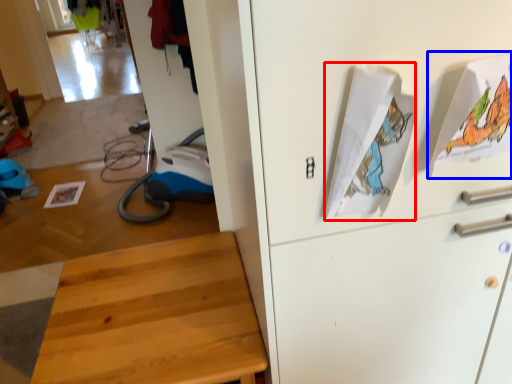
Question: Which point is closer to the camera, wrapping paper (highlighted by a red box) or wrapping paper (highlighted by a blue box)?

Choices:
 (A) wrapping paper
 (B) wrapping paper

Answer: (A)